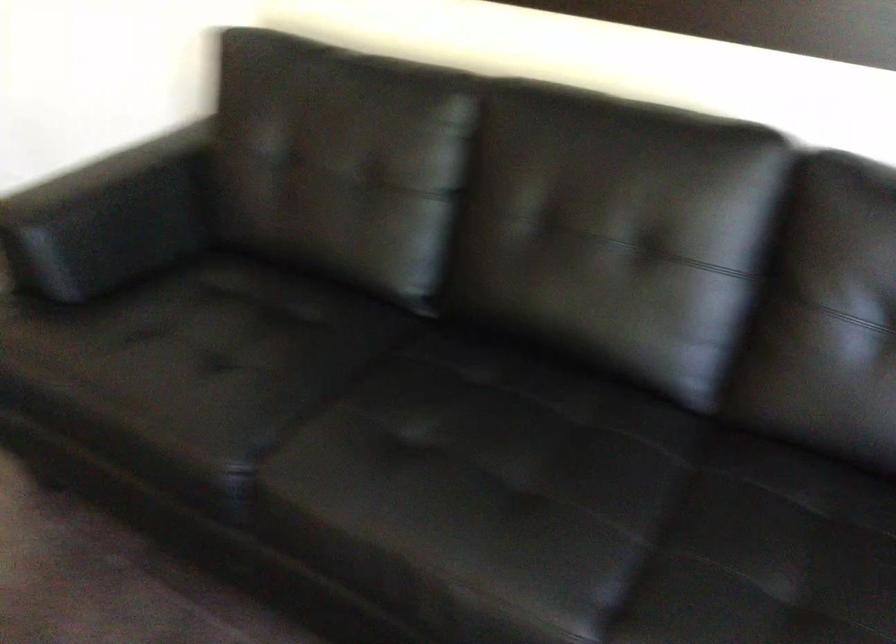
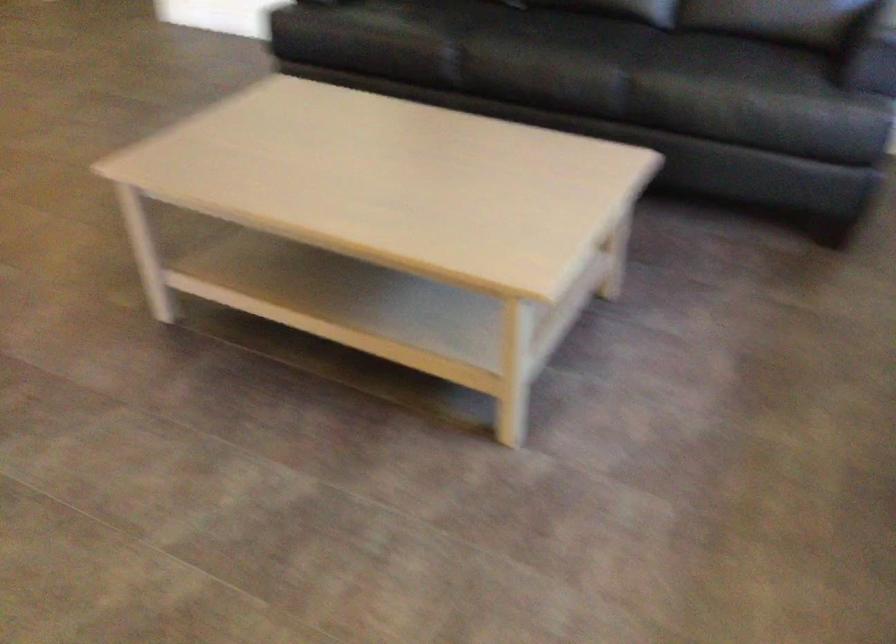
In a continuous first-person perspective shot, in which direction is the camera moving?

The cameraman walked toward left, backward.